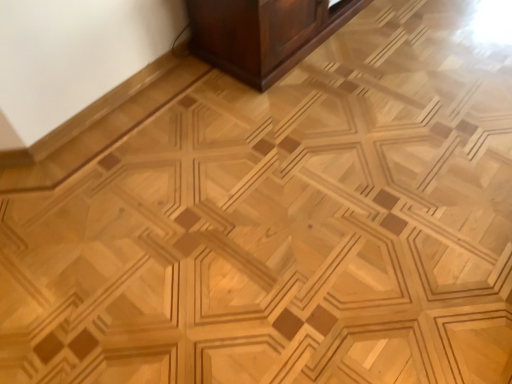
Describe the element at coordinates (263, 34) in the screenshot. I see `dark wood cabinet at upper center` at that location.

Locate an element on the screen. The height and width of the screenshot is (384, 512). dark wood cabinet at upper center is located at coordinates (263, 34).

Where is `dark wood cabinet at upper center`? dark wood cabinet at upper center is located at coordinates (263, 34).